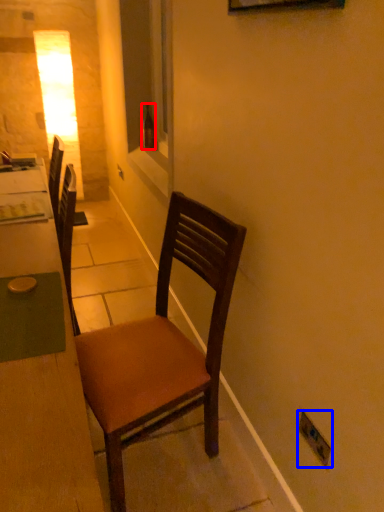
Question: Which object is closer to the camera taking this photo, bottle (highlighted by a red box) or electric outlet (highlighted by a blue box)?

Choices:
 (A) bottle
 (B) electric outlet

Answer: (B)